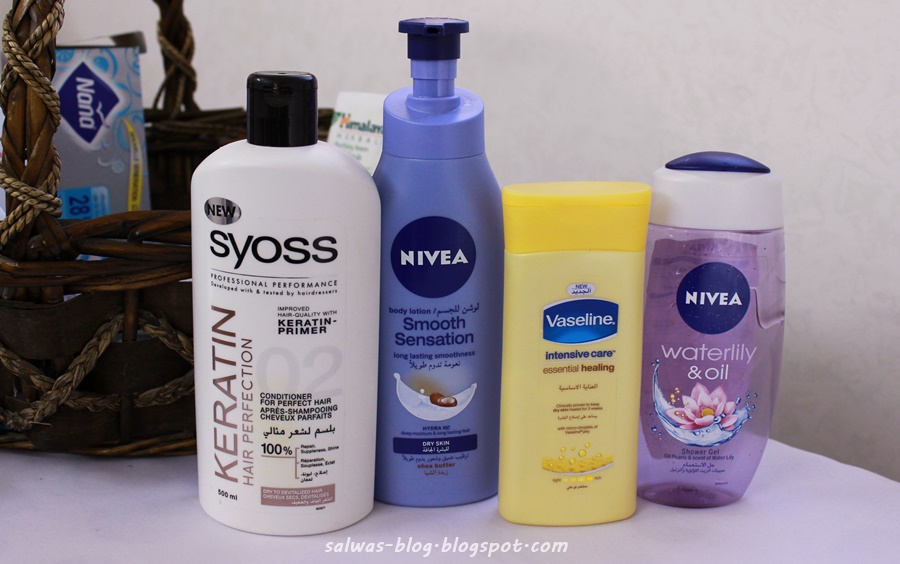
Where is `bottle`? This screenshot has height=564, width=900. bottle is located at coordinates (285, 374), (445, 316), (580, 349), (726, 257).